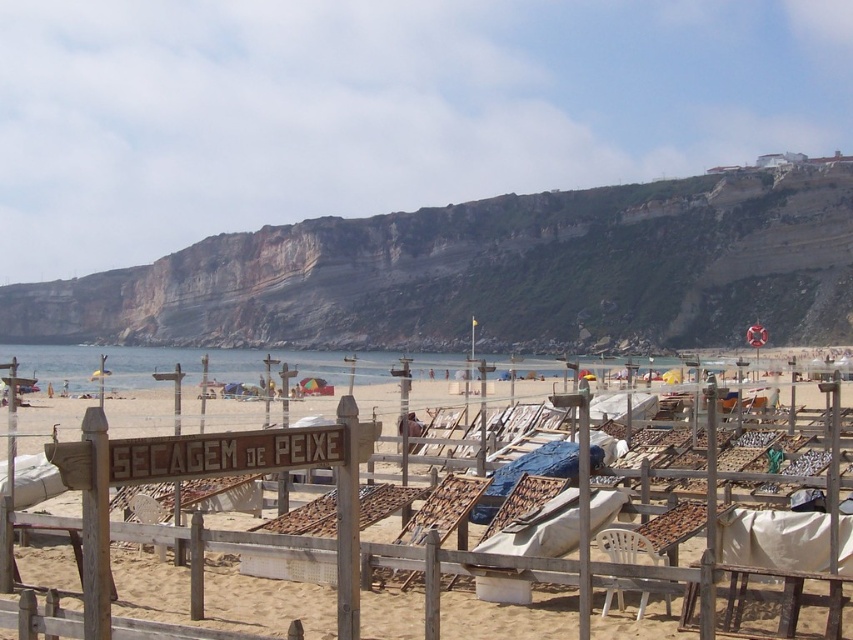
You are standing on the beach and want to reach the point marked at coordinates (682, 337). If your walking speed is 1.5 meters per second, how many seconds will it take you to reach that point?

The point at (682, 337) is 146.62 meters away from you. At a walking speed of 1.5 meters per second, it would take approximately 97.75 seconds to reach it. Since you can round to the nearest whole number, it would take about 98 seconds.

You are standing on the beach looking towards the rugged stone cliff at upper center and the white plastic chair at lower center. Which object appears closer to you?

The white plastic chair at lower center appears closer because it is positioned nearer to the viewer compared to the rugged stone cliff at upper center which is further away.

In the scene shown: You are a photographer planning to capture the rugged stone cliff at upper center and the wooden lounge chairs at center in a single frame. Based on their sizes, which object would occupy more space horizontally in the photo?

The rugged stone cliff at upper center would occupy more space horizontally in the photo because its width is larger than that of the wooden lounge chairs at center.